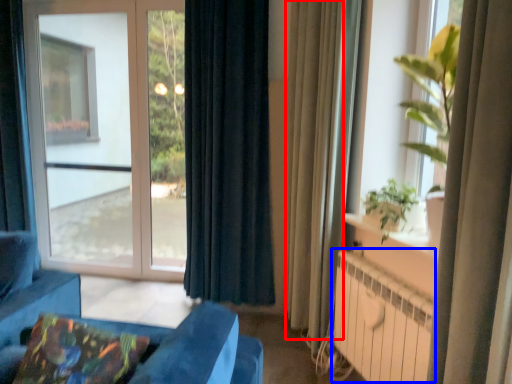
Question: Which of the following is the closest to the observer, curtain (highlighted by a red box) or radiator (highlighted by a blue box)?

Choices:
 (A) curtain
 (B) radiator

Answer: (B)